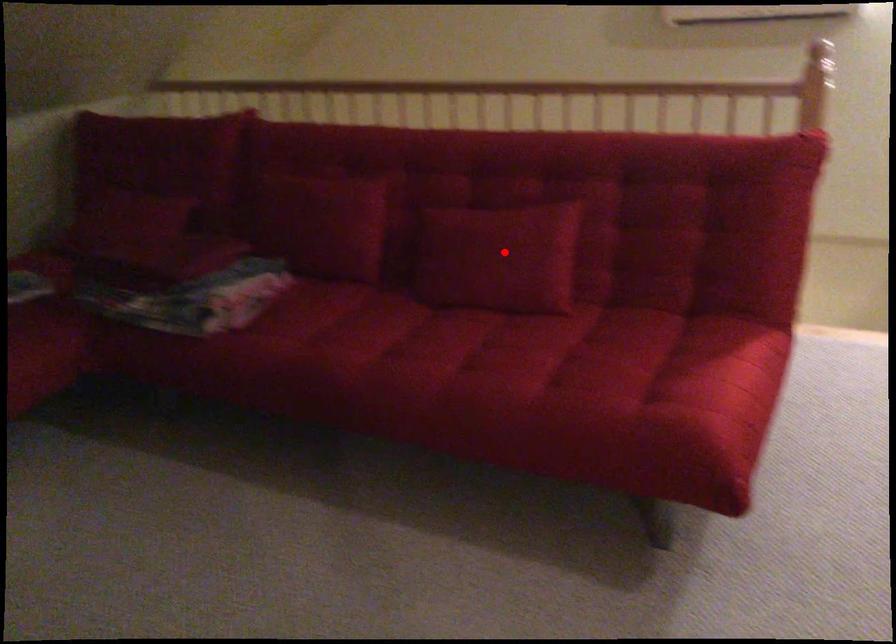
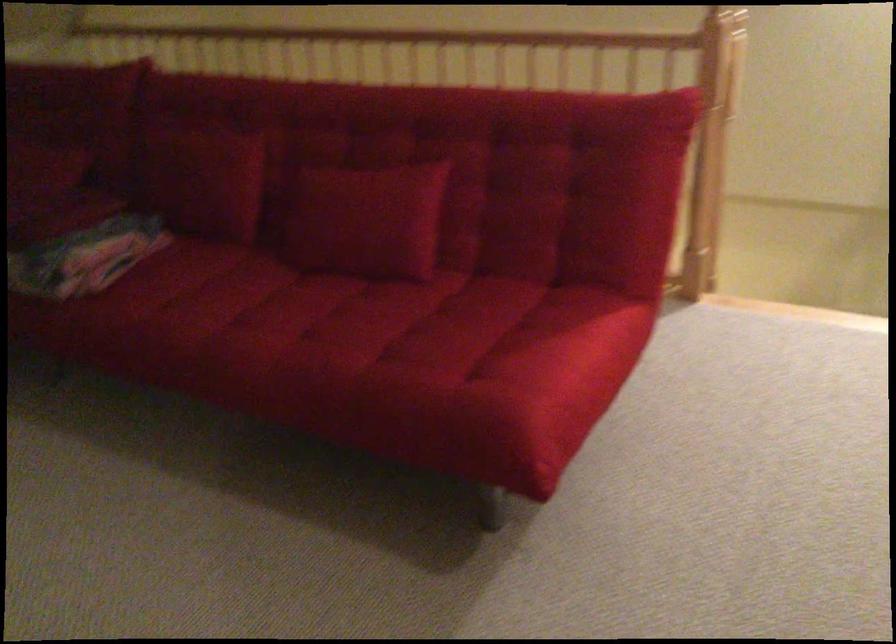
Locate, in the second image, the point that corresponds to the highlighted location in the first image.

(366, 220)